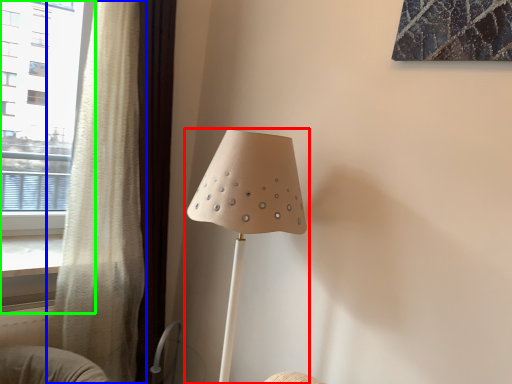
Question: Which object is the farthest from lamp (highlighted by a red box)? Choose among these: curtain (highlighted by a blue box) or window (highlighted by a green box).

Choices:
 (A) curtain
 (B) window

Answer: (B)